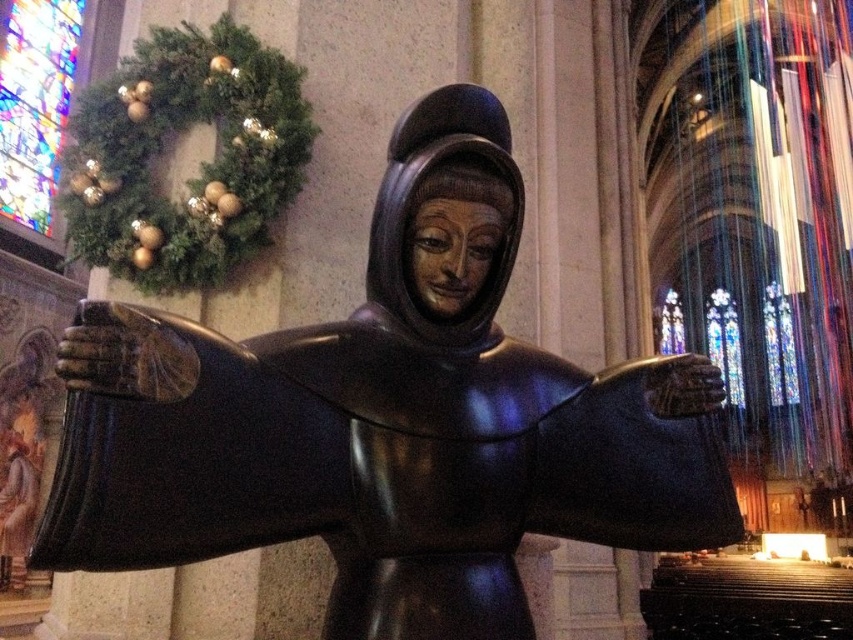
In order to click on shiny bronze statue at center in this screenshot , I will do `click(386, 420)`.

Which is more to the left, shiny bronze statue at center or stained glass window at upper left?

stained glass window at upper left is more to the left.

Does shiny bronze statue at center have a smaller size compared to stained glass window at upper left?

Yes.

Which is behind, point (735, 540) or point (19, 4)?

The point (19, 4) is more distant.

You are a GUI agent. You are given a task and a screenshot of the screen. Output one action in this format:
    pyautogui.click(x=<x>, y=<y>)
    Task: Click on the shiny bronze statue at center
    The height and width of the screenshot is (640, 853).
    Given the screenshot: What is the action you would take?
    pyautogui.click(x=386, y=420)

Is point (61, 36) farther from viewer compared to point (723, 300)?

No, it is not.

Can you confirm if stained glass window at upper left is positioned to the right of stained glass window at upper right?

No, stained glass window at upper left is not to the right of stained glass window at upper right.

Which is in front, point (33, 218) or point (737, 384)?

Point (33, 218) is in front.

Where is `stained glass window at upper left`? Image resolution: width=853 pixels, height=640 pixels. stained glass window at upper left is located at coordinates point(33,104).